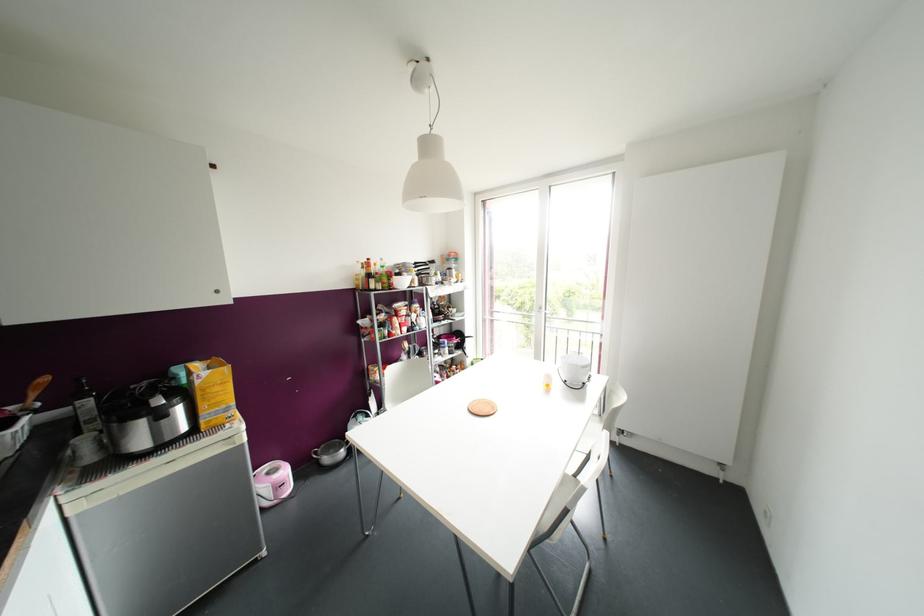
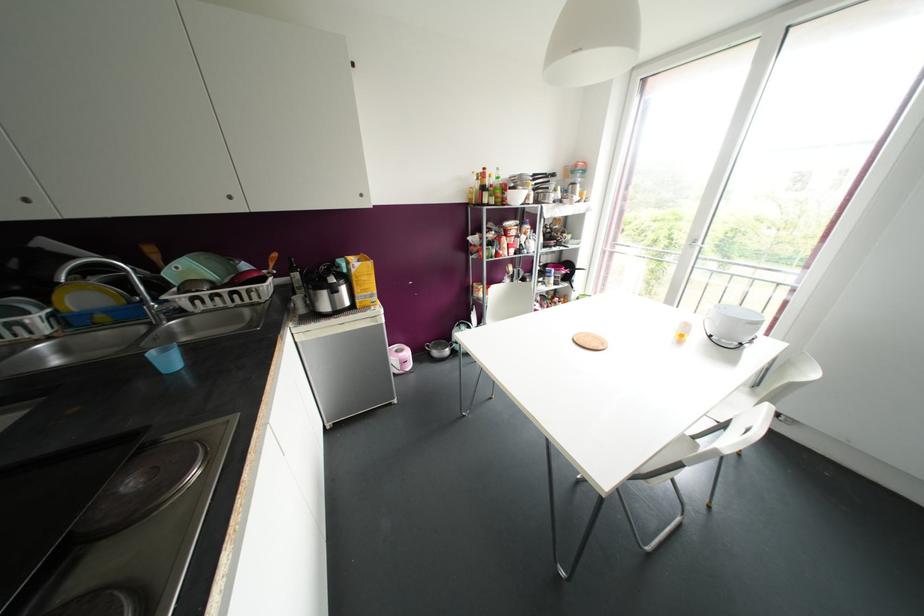
Find the pixel in the second image that matches the point at 90,421 in the first image.

(298, 286)